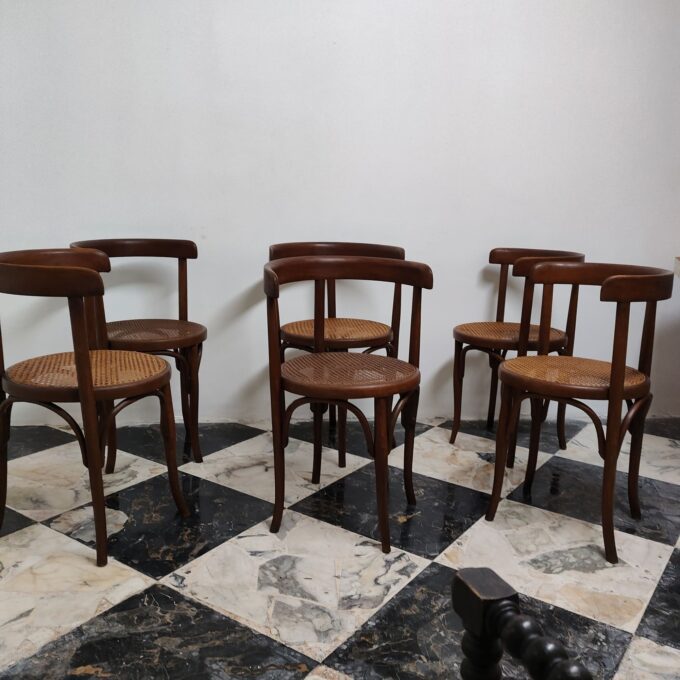
Identify the location of wooden chairs in front of wall. (136, 375), (185, 321), (379, 252), (387, 273), (568, 364), (513, 337).